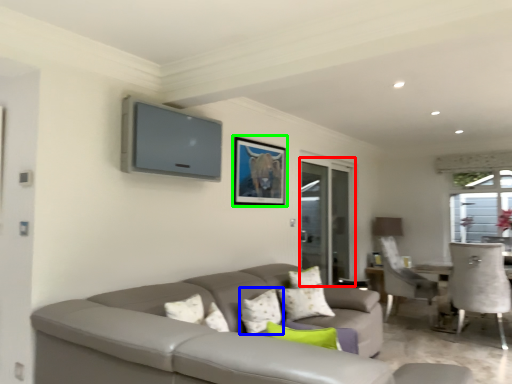
Question: Estimate the real-world distances between objects in this image. Which object is closer to screen door (highlighted by a red box), pillow (highlighted by a blue box) or picture frame (highlighted by a green box)?

Choices:
 (A) pillow
 (B) picture frame

Answer: (B)